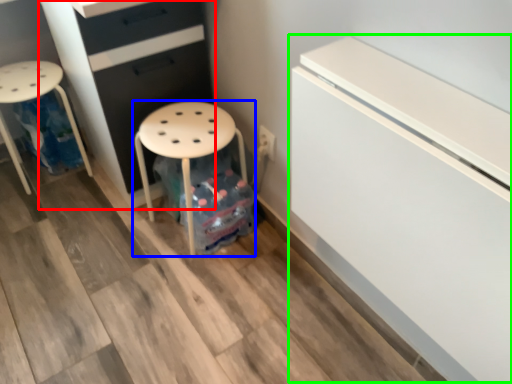
Question: Which object is positioned closest to chest of drawers (highlighted by a red box)? Select from stool (highlighted by a blue box) and fridge (highlighted by a green box).

Choices:
 (A) stool
 (B) fridge

Answer: (A)